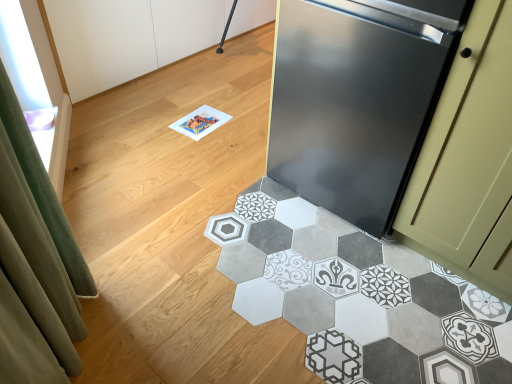
Question: Considering the positions of point (366, 34) and point (302, 263), is point (366, 34) closer or farther from the camera than point (302, 263)?

Choices:
 (A) closer
 (B) farther

Answer: (A)

Question: Based on their positions, is stainless steel refrigerator at right located to the left or right of patterned tile floor at lower right?

Choices:
 (A) right
 (B) left

Answer: (A)

Question: Is stainless steel refrigerator at right taller or shorter than patterned tile floor at lower right?

Choices:
 (A) tall
 (B) short

Answer: (A)

Question: Does point (242, 208) appear closer or farther from the camera than point (370, 165)?

Choices:
 (A) closer
 (B) farther

Answer: (B)

Question: From the image's perspective, is patterned tile floor at lower right above or below stainless steel refrigerator at right?

Choices:
 (A) above
 (B) below

Answer: (B)

Question: From a real-world perspective, relative to stainless steel refrigerator at right, is patterned tile floor at lower right vertically above or below?

Choices:
 (A) below
 (B) above

Answer: (A)

Question: Looking at their shapes, would you say patterned tile floor at lower right is wider or thinner than stainless steel refrigerator at right?

Choices:
 (A) thin
 (B) wide

Answer: (B)